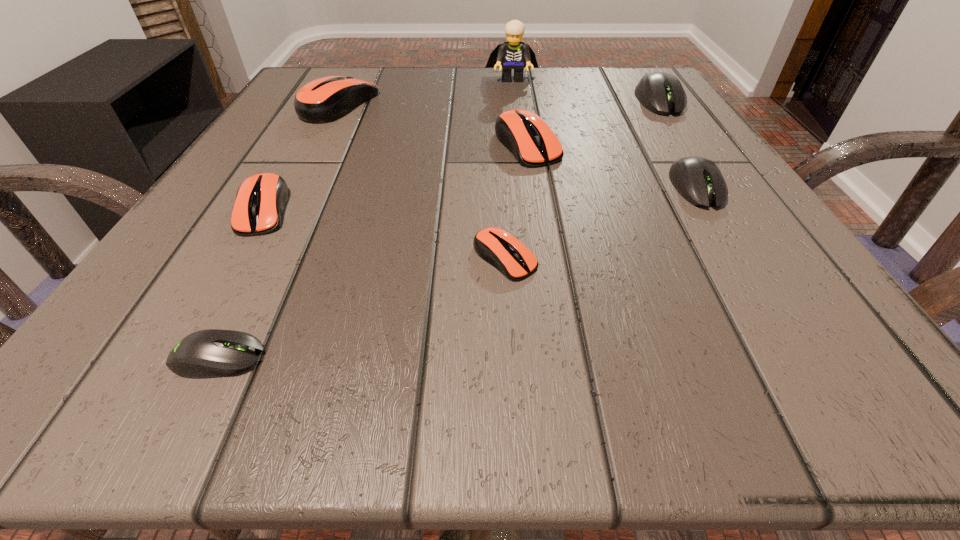
Find the location of a particular element. This screenshot has width=960, height=540. object that is positioned at the far left corner is located at coordinates (324, 100).

Find the location of a particular element. The image size is (960, 540). object positioned at the near left corner is located at coordinates coord(212,353).

Where is `object that is at the far right corner`? This screenshot has height=540, width=960. object that is at the far right corner is located at coordinates (661, 93).

Where is `vacant space at the far edge`? vacant space at the far edge is located at coordinates (474, 94).

Locate an element on the screen. free space at the near edge is located at coordinates (472, 396).

Locate an element on the screen. vacant region at the left edge of the desktop is located at coordinates (218, 316).

Find the location of a particular element. free space at the right edge of the desktop is located at coordinates (807, 276).

This screenshot has height=540, width=960. In the image, there is a desktop. Find the location of `vacant space at the far left corner`. vacant space at the far left corner is located at coordinates (365, 70).

This screenshot has height=540, width=960. I want to click on free spot at the far right corner of the desktop, so click(x=601, y=80).

The height and width of the screenshot is (540, 960). In order to click on free space between the smallest orange computer mouse and the second biggest orange computer mouse in this screenshot , I will do `click(516, 201)`.